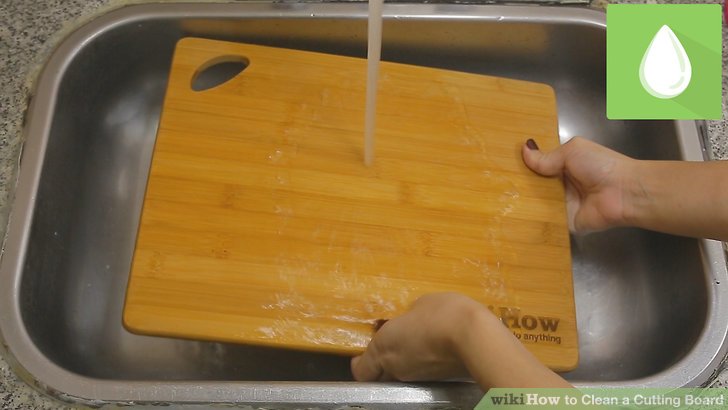
Locate an element on the screen. This screenshot has width=728, height=410. water running from faucet is located at coordinates (376, 46).